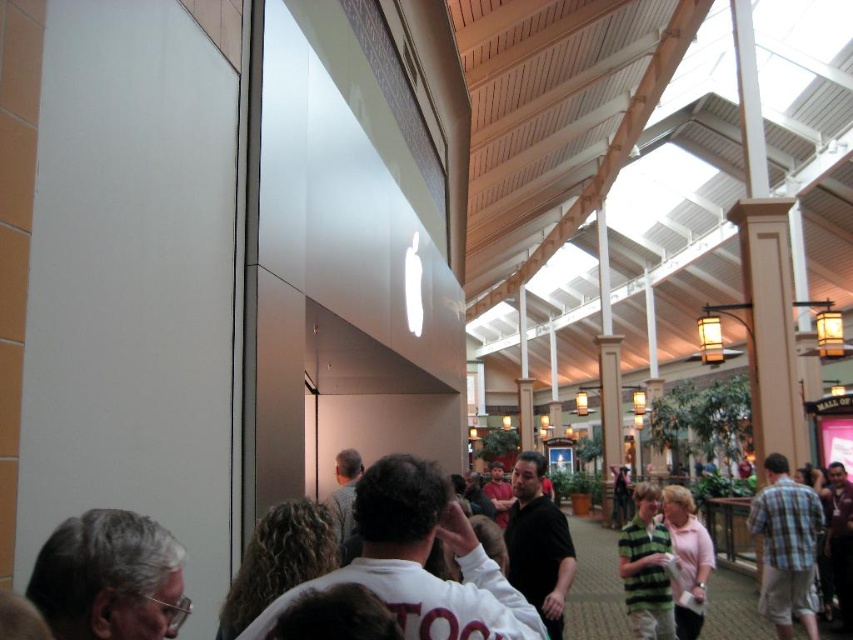
Question: Can you confirm if gray hair at lower left is smaller than striped green shirt at center?

Choices:
 (A) no
 (B) yes

Answer: (A)

Question: Which point is farther to the camera?

Choices:
 (A) (712, 568)
 (B) (102, 554)
 (C) (786, 592)

Answer: (C)

Question: Estimate the real-world distances between objects in this image. Which object is farther from the plaid cotton shirt at center?

Choices:
 (A) gray hair at lower left
 (B) pink fabric shirt at center
 (C) striped green shirt at center

Answer: (A)

Question: Is plaid cotton shirt at center closer to the viewer compared to striped green shirt at center?

Choices:
 (A) yes
 (B) no

Answer: (B)

Question: Is gray hair at lower left wider than pink fabric shirt at center?

Choices:
 (A) no
 (B) yes

Answer: (A)

Question: Which point is closer to the camera?

Choices:
 (A) (161, 634)
 (B) (779, 525)
 (C) (675, 618)
 (D) (639, 513)

Answer: (A)